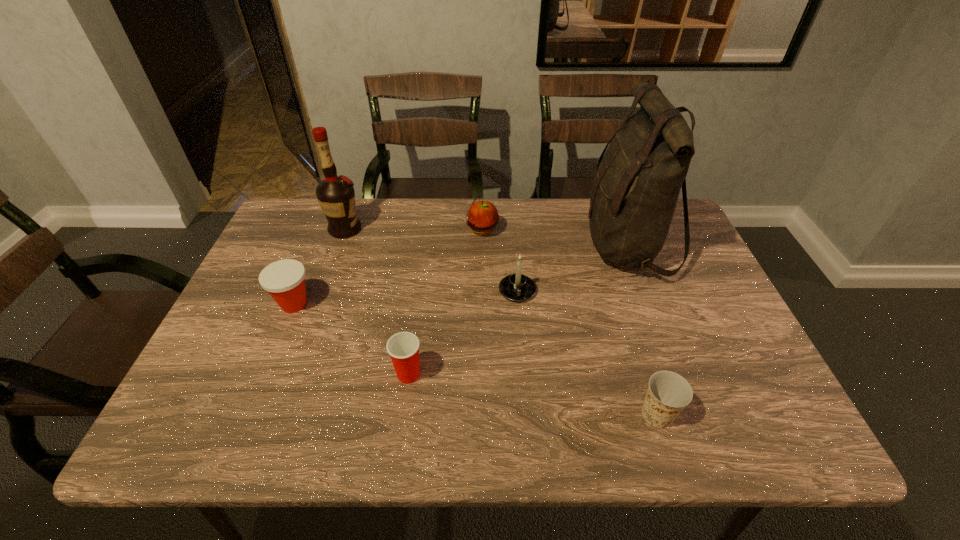
At what (x,y) coordinates should I click in order to perform the action: click on apple situated at the far edge. Please return your answer as a coordinate pair (x, y). The width and height of the screenshot is (960, 540). Looking at the image, I should click on (482, 217).

You are a GUI agent. You are given a task and a screenshot of the screen. Output one action in this format:
    pyautogui.click(x=<x>, y=<y>)
    Task: Click on the object located at the near edge
    The width and height of the screenshot is (960, 540).
    Given the screenshot: What is the action you would take?
    pyautogui.click(x=668, y=393)

You are a GUI agent. You are given a task and a screenshot of the screen. Output one action in this format:
    pyautogui.click(x=<x>, y=<y>)
    Task: Click on the liquor present at the left edge
    
    Given the screenshot: What is the action you would take?
    pyautogui.click(x=336, y=196)

The height and width of the screenshot is (540, 960). Identify the location of Dixie cup that is at the left edge. (284, 280).

Identify the location of object located at the right edge. Image resolution: width=960 pixels, height=540 pixels. (635, 191).

Identify the location of object that is at the far left corner. This screenshot has width=960, height=540. (336, 196).

Find the location of a particular element. object that is at the far right corner is located at coordinates (635, 191).

This screenshot has height=540, width=960. I want to click on vacant space at the far edge of the desktop, so click(x=378, y=227).

Locate an element on the screen. This screenshot has width=960, height=540. free region at the left edge of the desktop is located at coordinates pos(238,376).

Where is `vacant space at the right edge of the desktop`? The image size is (960, 540). vacant space at the right edge of the desktop is located at coordinates (732, 377).